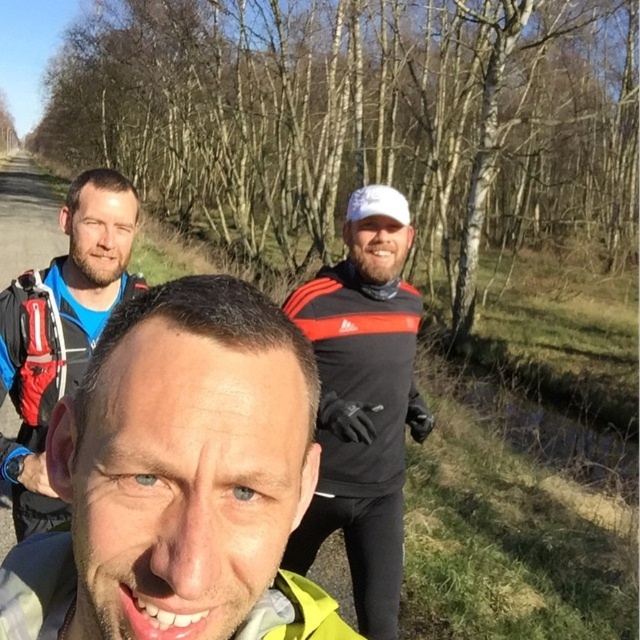
Question: Estimate the real-world distances between objects in this image. Which object is farther from the matte blue jacket at upper left?

Choices:
 (A) matte black jacket at center
 (B) black matte jacket at center

Answer: (A)

Question: Can you confirm if matte black jacket at center is positioned below black matte jacket at center?

Choices:
 (A) no
 (B) yes

Answer: (A)

Question: Which point is farther to the camera?

Choices:
 (A) (337, 438)
 (B) (81, 188)

Answer: (A)

Question: In this image, where is matte black jacket at center located relative to black matte jacket at center?

Choices:
 (A) left
 (B) right

Answer: (A)

Question: From the image, what is the correct spatial relationship of matte black jacket at center in relation to black matte jacket at center?

Choices:
 (A) below
 (B) above

Answer: (B)

Question: Which is farther from the matte blue jacket at upper left?

Choices:
 (A) black matte jacket at center
 (B) matte black jacket at center

Answer: (B)